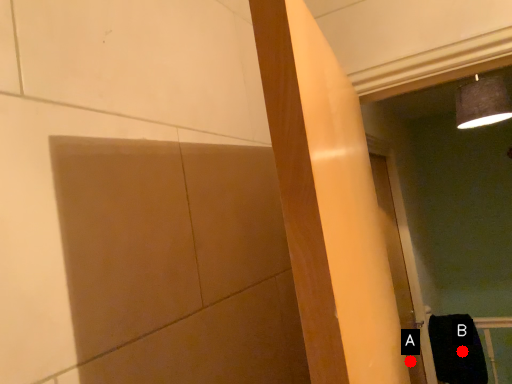
Question: Two points are circled on the image, labeled by A and B beside each circle. Which point appears farthest from the camera in this image?

Choices:
 (A) A is further
 (B) B is further

Answer: (B)